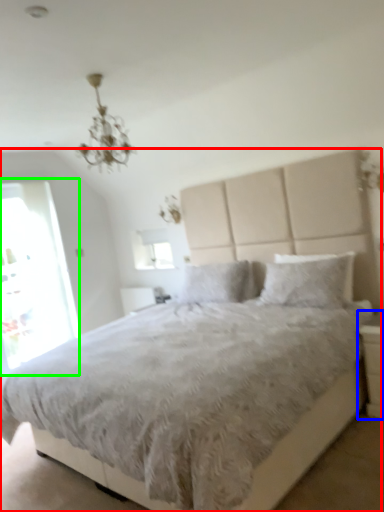
Question: Which object is positioned closest to bed (highlighted by a red box)? Select from nightstand (highlighted by a blue box) and glass door (highlighted by a green box).

Choices:
 (A) nightstand
 (B) glass door

Answer: (B)